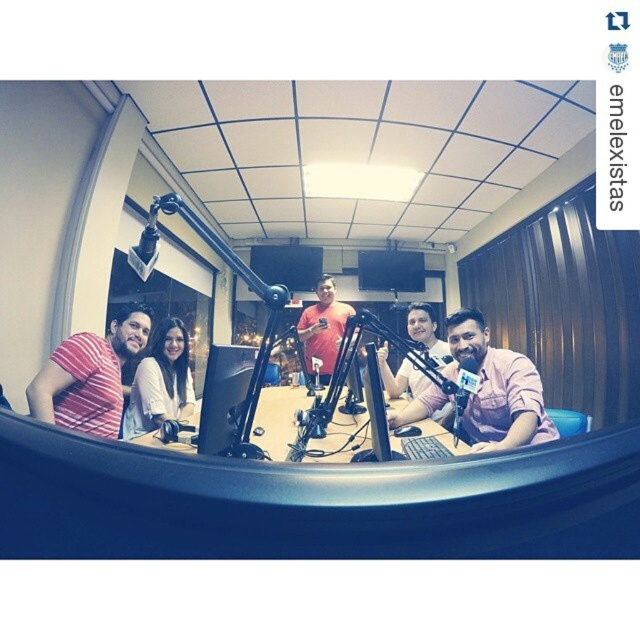
Question: Is striped cotton shirt at left closer to the viewer compared to matte black monitor at center?

Choices:
 (A) no
 (B) yes

Answer: (A)

Question: Which point is closer to the camera?

Choices:
 (A) (221, 358)
 (B) (332, 356)
 (C) (186, 376)
 (D) (509, 371)

Answer: (A)

Question: Which is farther from the matte black microphone at center?

Choices:
 (A) pink matte shirt at center
 (B) striped cotton shirt at left

Answer: (A)

Question: Does matte white shirt at left come in front of matte black monitor at center?

Choices:
 (A) no
 (B) yes

Answer: (A)

Question: Can you confirm if pink matte shirt at center is positioned below striped cotton shirt at left?

Choices:
 (A) yes
 (B) no

Answer: (A)

Question: Considering the real-world distances, which object is closest to the matte red shirt at center?

Choices:
 (A) matte white shirt at left
 (B) matte black monitor at center
 (C) pink matte shirt at center
 (D) striped cotton shirt at left

Answer: (A)